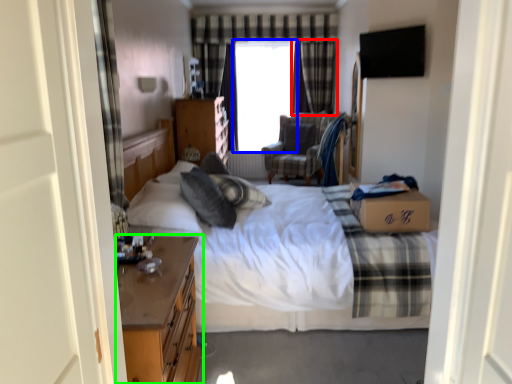
Question: Which object is the farthest from curtain (highlighted by a red box)? Choose among these: window screen (highlighted by a blue box) or nightstand (highlighted by a green box).

Choices:
 (A) window screen
 (B) nightstand

Answer: (B)